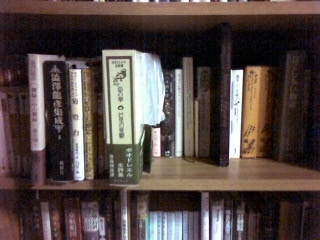
The image size is (320, 240). Find the location of `thick yellow book`. thick yellow book is located at coordinates (141, 47).